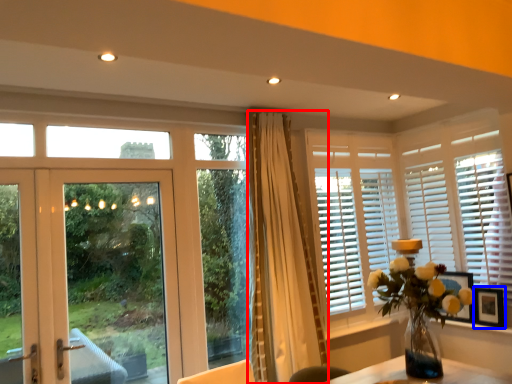
Question: Which object is closer to the camera taking this photo, curtain (highlighted by a red box) or picture frame (highlighted by a blue box)?

Choices:
 (A) curtain
 (B) picture frame

Answer: (A)